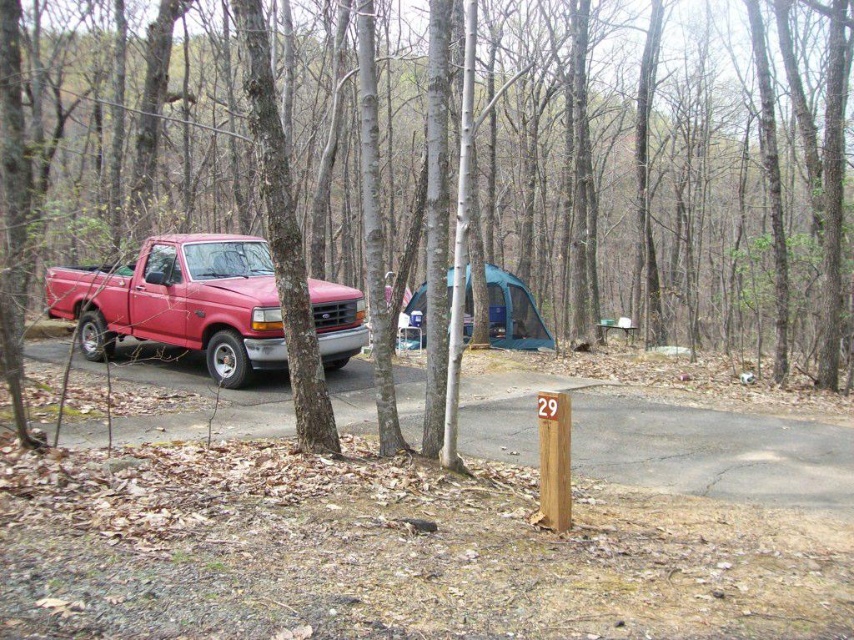
Question: Is smooth bark tree at center positioned at the back of matte red truck at left?

Choices:
 (A) yes
 (B) no

Answer: (B)

Question: Which point appears closest to the camera in this image?

Choices:
 (A) (194, 346)
 (B) (519, 332)
 (C) (607, 221)

Answer: (A)

Question: Does smooth bark tree at center appear on the left side of teal fabric tent at center?

Choices:
 (A) yes
 (B) no

Answer: (B)

Question: From the image, what is the correct spatial relationship of smooth bark tree at center in relation to matte red truck at left?

Choices:
 (A) left
 (B) right

Answer: (B)

Question: Which object is closer to the camera taking this photo?

Choices:
 (A) teal fabric tent at center
 (B) matte red truck at left

Answer: (B)

Question: Among these points, which one is farthest from the camera?

Choices:
 (A) (759, 134)
 (B) (231, 344)
 (C) (525, 292)

Answer: (C)